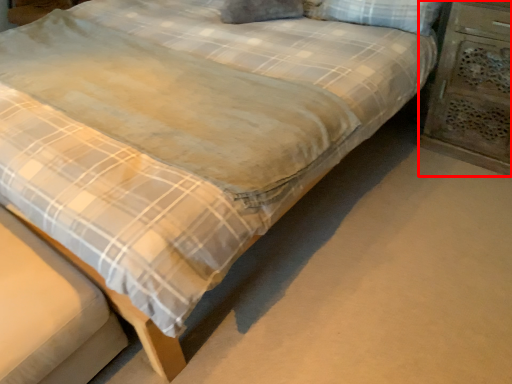
Question: From the image's perspective, where is nightstand (annotated by the red box) located in relation to pillow in the image?

Choices:
 (A) above
 (B) below

Answer: (B)